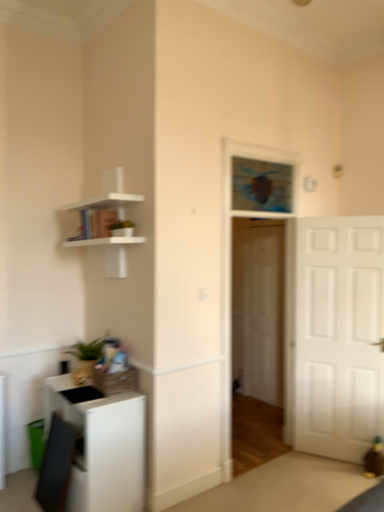
The height and width of the screenshot is (512, 384). What are the coordinates of `free space in front of white matte door at right, which is the second door in back-to-front order` in the screenshot? It's located at (331, 480).